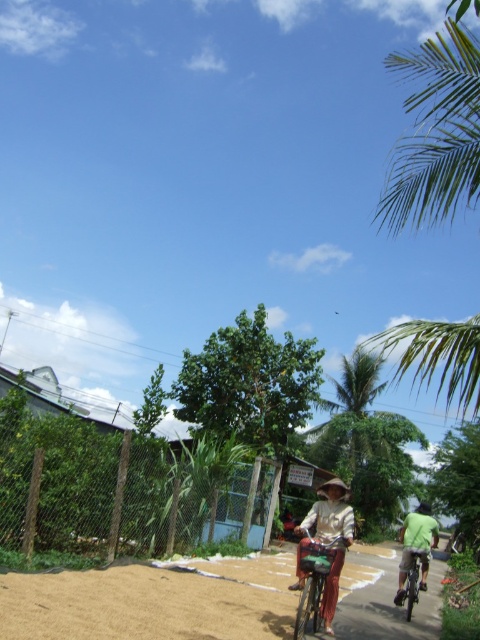
You are standing at the center of the sandy area and want to take a photo of the green leafy palm tree at upper right. Which direction should you face to capture it in your frame?

Since the green leafy palm tree at upper right is located at point 0.203 in the x coordinate, which is on the left side of the image, you should face towards the left direction to capture it in your frame.

You are standing at the edge of the sandy area where the metallic silver bicycle at center is parked. You need to reach the green fabric shirt at right, which is wearing by a person further down the path. Can you walk directly to the shirt without going around any obstacles?

The metallic silver bicycle at center is 3.20 meters away from the green fabric shirt at right. Since there are no obstacles mentioned between them in the scene description, you can walk directly to the shirt.

You are a photographer trying to capture a closeup shot of the green fabric shirt at right and the metallic silver bicycle at right. What is the minimum distance you need to adjust your camera lens to focus on both subjects simultaneously?

The green fabric shirt at right is 10.04 inches from the metallic silver bicycle at right. To focus on both subjects simultaneously, the camera lens must be adjusted to a minimum distance that accommodates this separation between them.